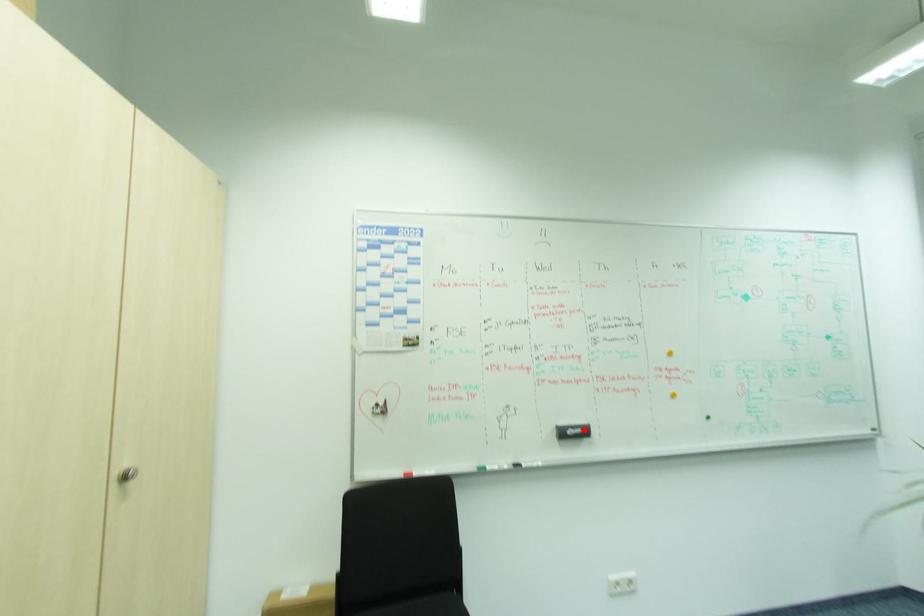
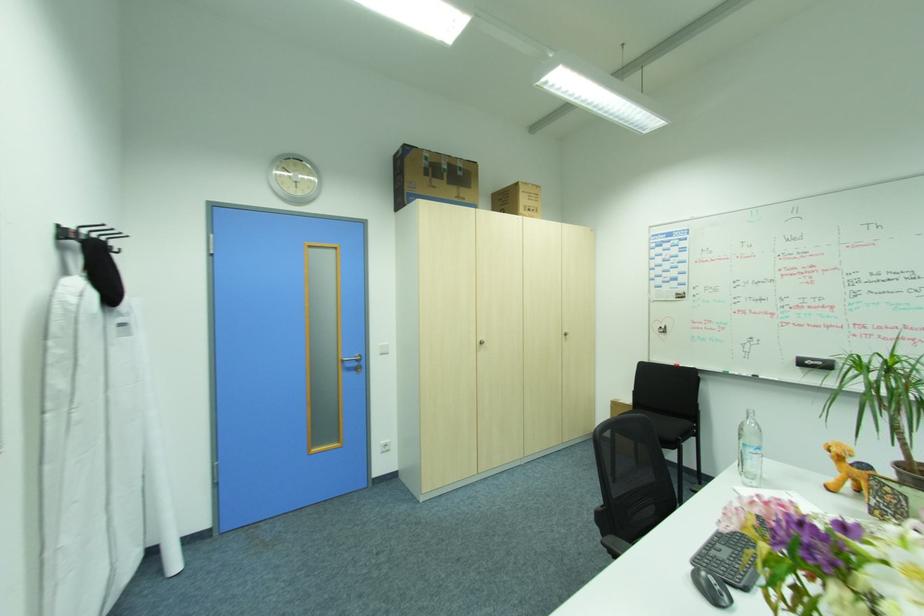
Locate, in the second image, the point that corresponds to the highlighted location in the first image.

(824, 363)